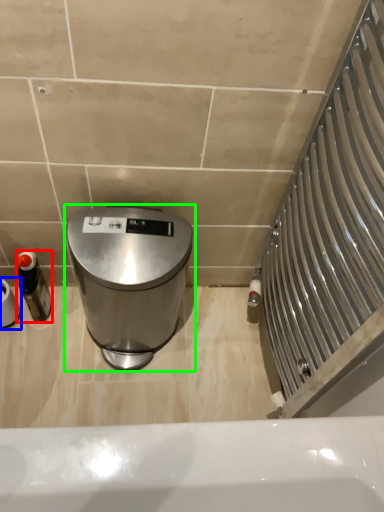
Question: Which is farther away from bottle (highlighted by a red box)? toilet paper (highlighted by a blue box) or waste container (highlighted by a green box)?

Choices:
 (A) toilet paper
 (B) waste container

Answer: (B)